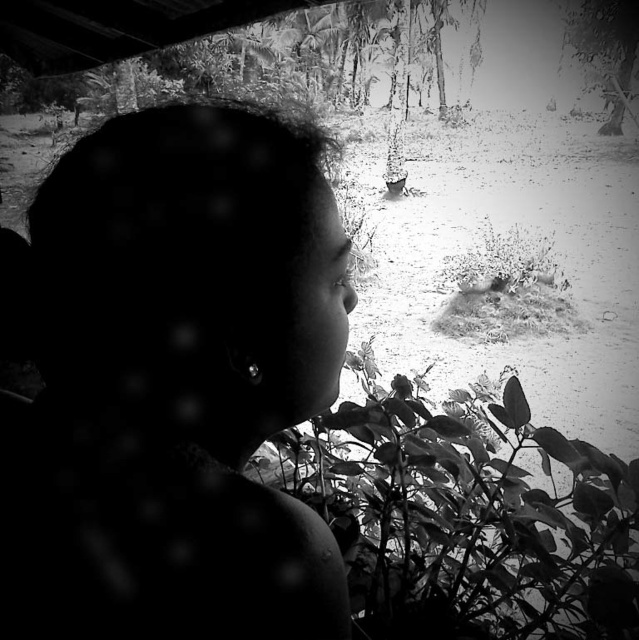
Question: Among these objects, which one is nearest to the camera?

Choices:
 (A) dark hair at left
 (B) leathery green leaves at center

Answer: (A)

Question: Is dark hair at left smaller than leathery green leaves at center?

Choices:
 (A) no
 (B) yes

Answer: (B)

Question: Which object appears closest to the camera in this image?

Choices:
 (A) dark hair at left
 (B) leathery green leaves at center

Answer: (A)

Question: In this image, where is dark hair at left located relative to leathery green leaves at center?

Choices:
 (A) left
 (B) right

Answer: (A)

Question: Can you confirm if dark hair at left is positioned above leathery green leaves at center?

Choices:
 (A) yes
 (B) no

Answer: (A)